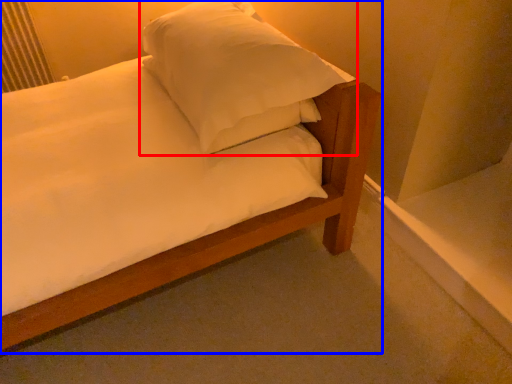
Question: Which point is further to the camera, pillow (highlighted by a red box) or bed (highlighted by a blue box)?

Choices:
 (A) pillow
 (B) bed

Answer: (B)